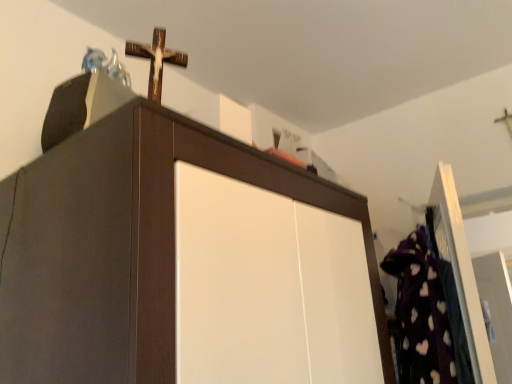
The height and width of the screenshot is (384, 512). Identify the location of wooden cross at upper center. (156, 60).

The width and height of the screenshot is (512, 384). What do you see at coordinates (156, 60) in the screenshot?
I see `wooden cross at upper center` at bounding box center [156, 60].

Identify the location of wooden cross at upper center. This screenshot has height=384, width=512. (156, 60).